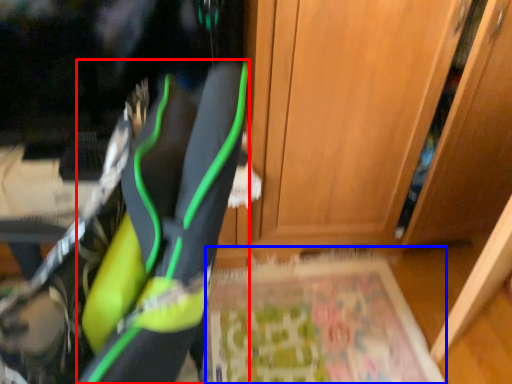
Question: Which point is closer to the camera, footwear (highlighted by a red box) or yoga mat (highlighted by a blue box)?

Choices:
 (A) footwear
 (B) yoga mat

Answer: (A)